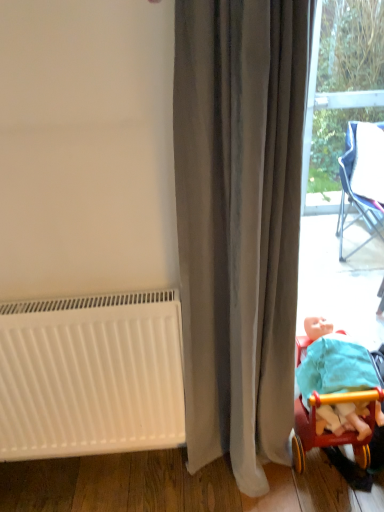
Question: From the image's perspective, is gray velvet curtain at center over wooden toy carriage at lower right?

Choices:
 (A) yes
 (B) no

Answer: (A)

Question: Is gray velvet curtain at center taller than wooden toy carriage at lower right?

Choices:
 (A) yes
 (B) no

Answer: (A)

Question: Is gray velvet curtain at center wider than wooden toy carriage at lower right?

Choices:
 (A) no
 (B) yes

Answer: (A)

Question: From the image's perspective, does gray velvet curtain at center appear lower than wooden toy carriage at lower right?

Choices:
 (A) yes
 (B) no

Answer: (B)

Question: From a real-world perspective, is gray velvet curtain at center on wooden toy carriage at lower right?

Choices:
 (A) yes
 (B) no

Answer: (A)

Question: Does gray velvet curtain at center have a smaller size compared to wooden toy carriage at lower right?

Choices:
 (A) yes
 (B) no

Answer: (B)

Question: Does wooden toy carriage at lower right come behind white matte radiator at lower left?

Choices:
 (A) no
 (B) yes

Answer: (B)

Question: Is wooden toy carriage at lower right aimed at white matte radiator at lower left?

Choices:
 (A) no
 (B) yes

Answer: (A)

Question: Does wooden toy carriage at lower right appear on the right side of white matte radiator at lower left?

Choices:
 (A) no
 (B) yes

Answer: (B)

Question: From the image's perspective, is wooden toy carriage at lower right located beneath white matte radiator at lower left?

Choices:
 (A) no
 (B) yes

Answer: (B)

Question: Is wooden toy carriage at lower right in contact with white matte radiator at lower left?

Choices:
 (A) yes
 (B) no

Answer: (B)

Question: Considering the relative sizes of wooden toy carriage at lower right and white matte radiator at lower left in the image provided, is wooden toy carriage at lower right taller than white matte radiator at lower left?

Choices:
 (A) yes
 (B) no

Answer: (B)

Question: Is gray velvet curtain at center thinner than white matte radiator at lower left?

Choices:
 (A) no
 (B) yes

Answer: (A)